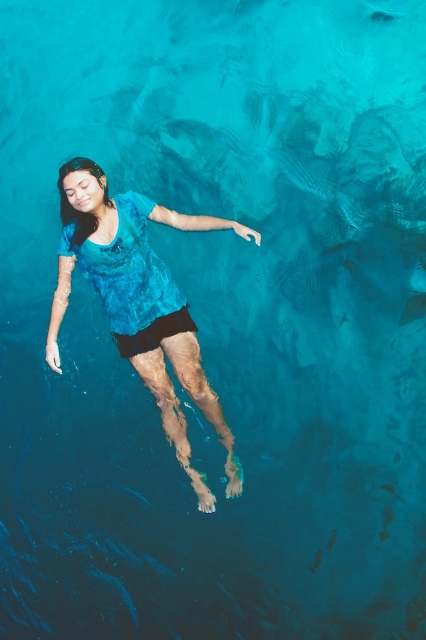
Question: Is blue fabric shirt at center to the left of black matte shorts at center from the viewer's perspective?

Choices:
 (A) yes
 (B) no

Answer: (B)

Question: Which point appears closest to the camera in this image?

Choices:
 (A) (143, 353)
 (B) (187, 308)

Answer: (A)

Question: Does blue fabric shirt at center come in front of black matte shorts at center?

Choices:
 (A) yes
 (B) no

Answer: (A)

Question: Which point is farther to the camera?

Choices:
 (A) black matte shorts at center
 (B) blue fabric shirt at center

Answer: (A)

Question: Is blue fabric shirt at center behind black matte shorts at center?

Choices:
 (A) no
 (B) yes

Answer: (A)

Question: Which of the following is the farthest from the observer?

Choices:
 (A) (154, 340)
 (B) (255, 237)

Answer: (B)